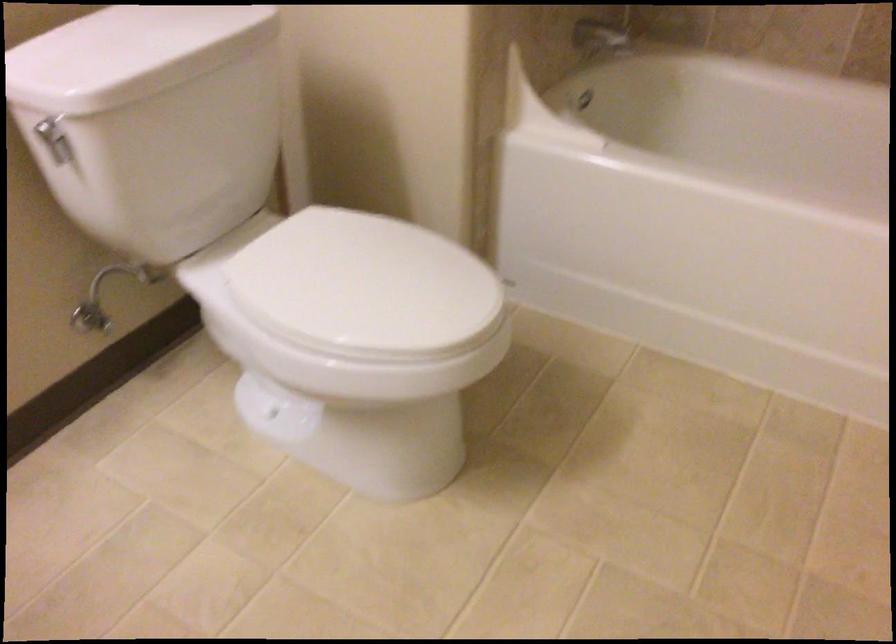
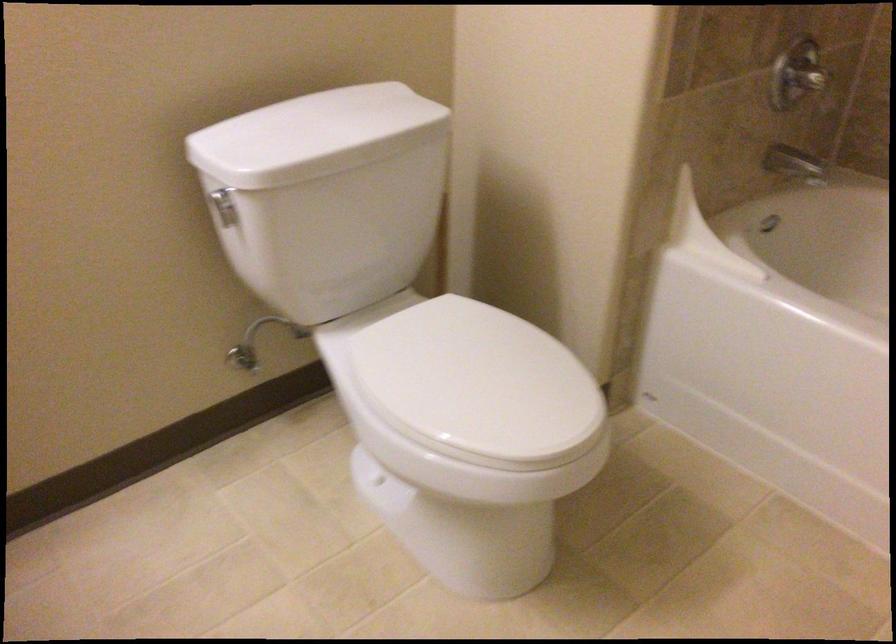
Locate, in the second image, the point that corresponds to point (328, 276) in the first image.

(442, 363)